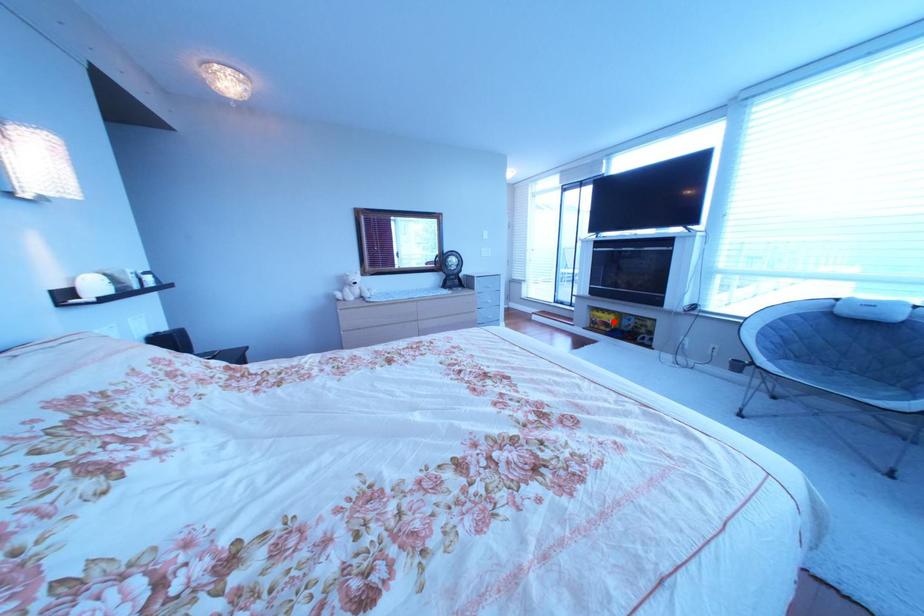
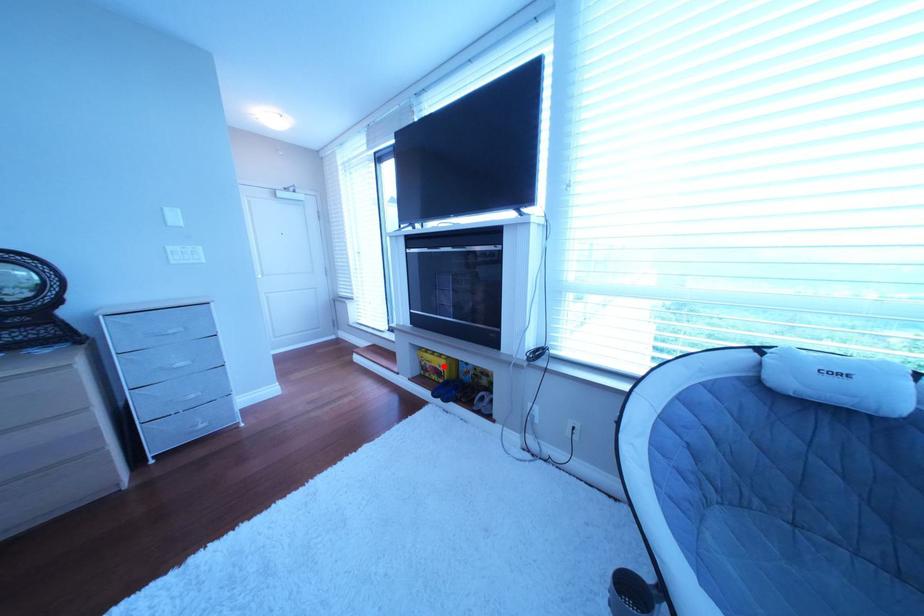
I am providing you with two images of the same scene from different viewpoints. A red point is marked on the first image and another point is marked on the second image. Are the points marked in image1 and image2 representing the same 3D position?

Yes